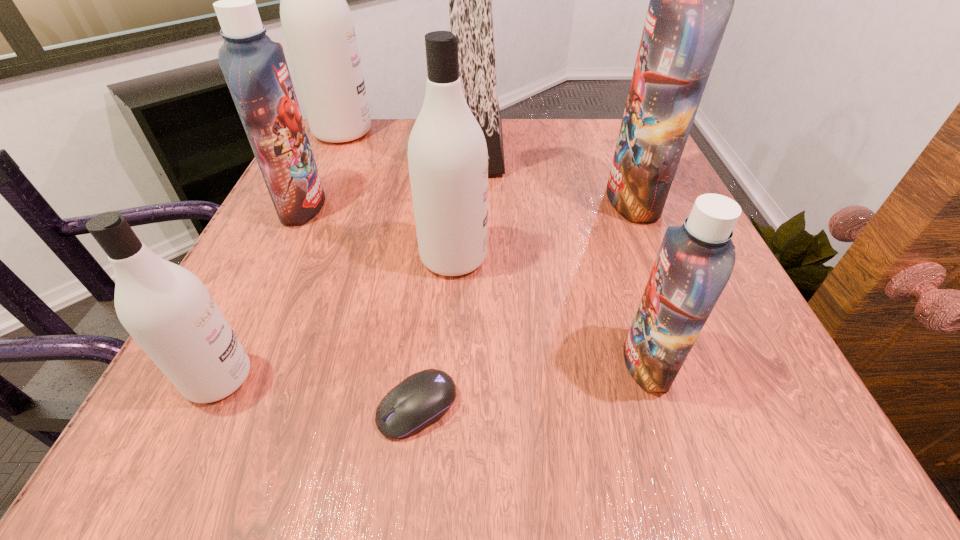
You are a GUI agent. You are given a task and a screenshot of the screen. Output one action in this format:
    pyautogui.click(x=<x>, y=<y>)
    Task: Click on the vacant space at the near edge of the desktop
    The height and width of the screenshot is (540, 960).
    Given the screenshot: What is the action you would take?
    pyautogui.click(x=509, y=405)

At what (x,y) coordinates should I click in order to perform the action: click on free space at the left edge of the desktop. Please return your answer as a coordinate pair (x, y). Looking at the image, I should click on (311, 232).

In the image, there is a desktop. Where is `vacant space at the right edge`? This screenshot has height=540, width=960. vacant space at the right edge is located at coordinates (637, 260).

The image size is (960, 540). In order to click on free space between the leftmost blue shampoo and the smallest blue shampoo in this screenshot , I will do `click(475, 285)`.

The width and height of the screenshot is (960, 540). In order to click on free spot between the smallest white shampoo and the shopping bag in this screenshot , I will do `click(348, 262)`.

The height and width of the screenshot is (540, 960). Identify the location of free area in between the second biggest blue shampoo and the fourth farthest shampoo. (378, 232).

Where is `empty location between the computer mouse and the shopping bag`? empty location between the computer mouse and the shopping bag is located at coordinates (447, 277).

In order to click on unoccupied area between the leftmost blue shampoo and the biggest white shampoo in this screenshot , I will do `click(323, 170)`.

Identify the location of unoccupied area between the shopping bag and the black computer mouse. (447, 277).

Locate an element on the screen. This screenshot has width=960, height=540. free spot between the second smallest white shampoo and the farthest shampoo is located at coordinates (398, 195).